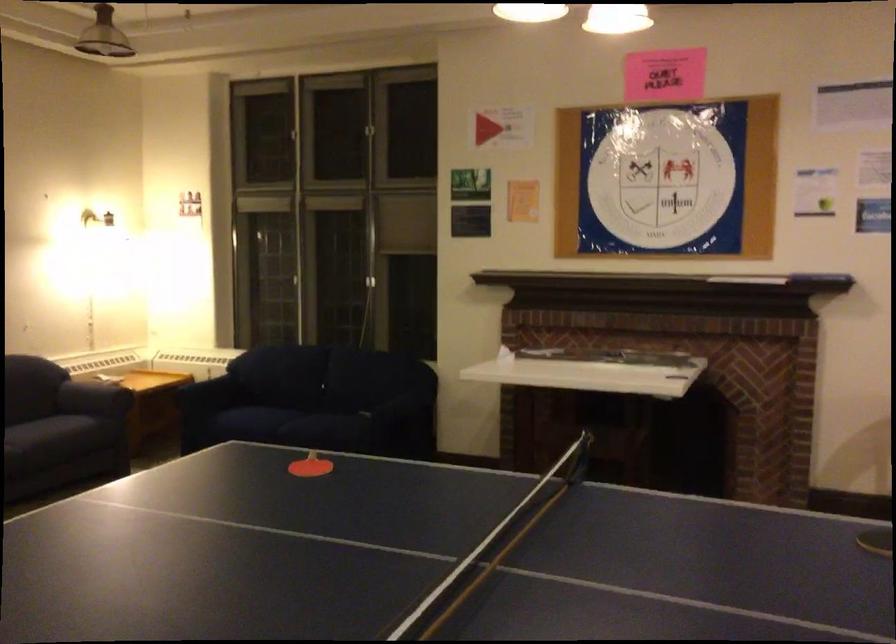
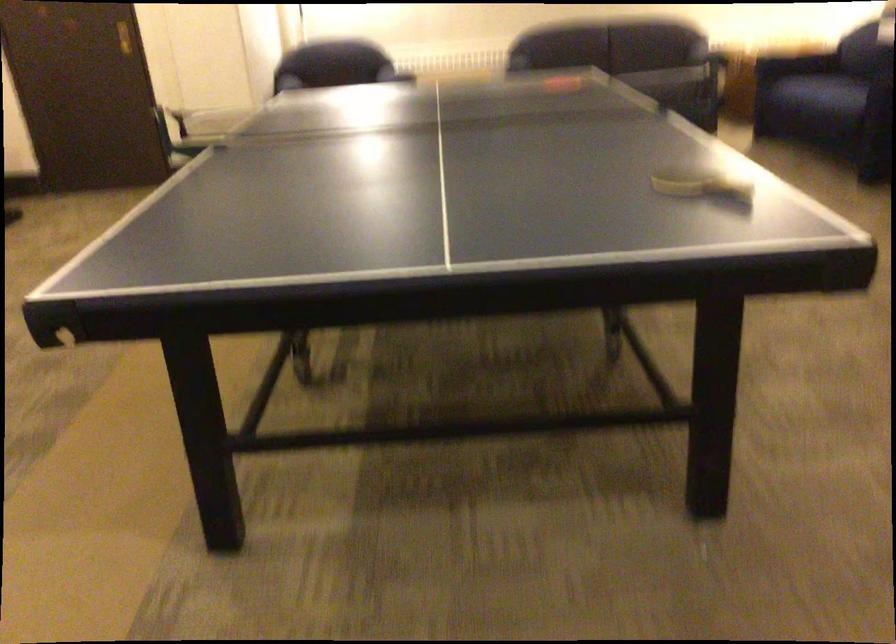
Question: I am providing you with two images of the same scene from different viewpoints. Which of the following objects are not visible in image2?

Choices:
 (A) dark sofa sitting surface
 (B) white floral bowl
 (C) sofa sitting surface
 (D) ping-pong paddle

Answer: (A)